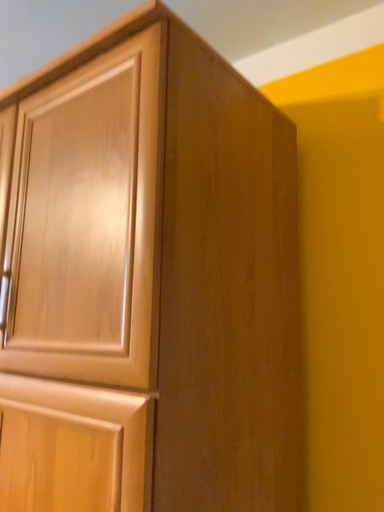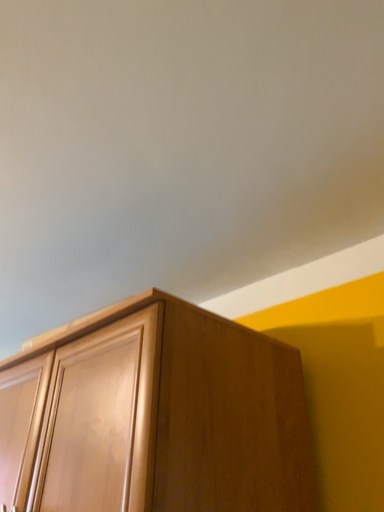
Question: How did the camera likely rotate when shooting the video?

Choices:
 (A) rotated upward
 (B) rotated downward

Answer: (A)